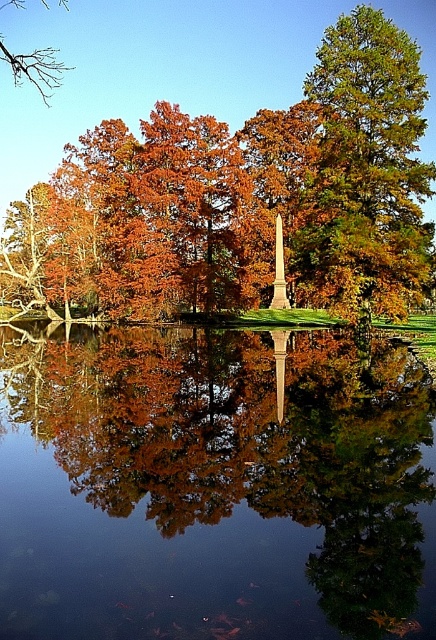
From the picture: Which is more to the left, transparent glass lake at center or green glossy tree at upper right?

transparent glass lake at center

Can you confirm if transparent glass lake at center is thinner than green glossy tree at upper right?

No, transparent glass lake at center is not thinner than green glossy tree at upper right.

Locate an element on the screen. The width and height of the screenshot is (436, 640). transparent glass lake at center is located at coordinates (214, 484).

Does point (422, 84) come behind point (283, 307)?

No, (422, 84) is in front of (283, 307).

Where is `green glossy tree at upper right`? green glossy tree at upper right is located at coordinates (365, 172).

Image resolution: width=436 pixels, height=640 pixels. In order to click on bare branch at upper left in this screenshot , I will do `click(34, 68)`.

Between point (20, 72) and point (280, 232), which one is positioned behind?

Positioned behind is point (20, 72).

Locate an element on the screen. bare branch at upper left is located at coordinates (34, 68).